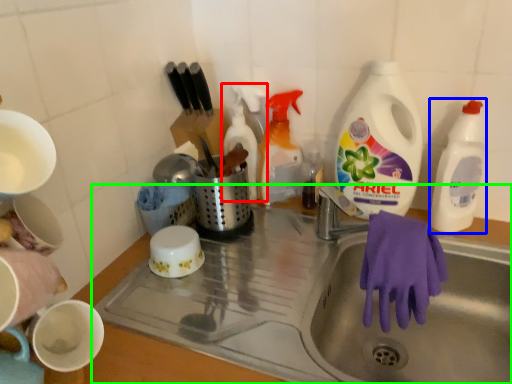
Question: Estimate the real-world distances between objects in this image. Which object is closer to cleaning product (highlighted by a red box), cleaning product (highlighted by a blue box) or sink (highlighted by a green box)?

Choices:
 (A) cleaning product
 (B) sink

Answer: (B)